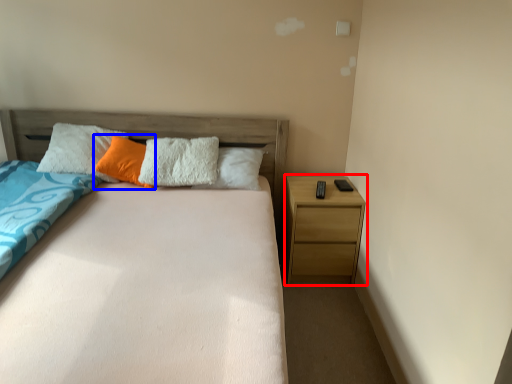
Question: Which object appears farthest to the camera in this image, nightstand (highlighted by a red box) or pillow (highlighted by a blue box)?

Choices:
 (A) nightstand
 (B) pillow

Answer: (A)